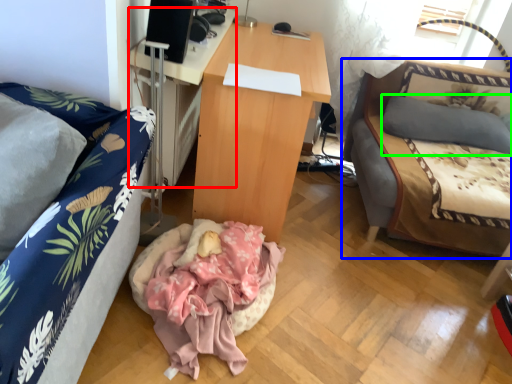
Question: Which object is positioned farthest from desk (highlighted by a red box)? Select from studio couch (highlighted by a blue box) and pillow (highlighted by a green box).

Choices:
 (A) studio couch
 (B) pillow

Answer: (B)